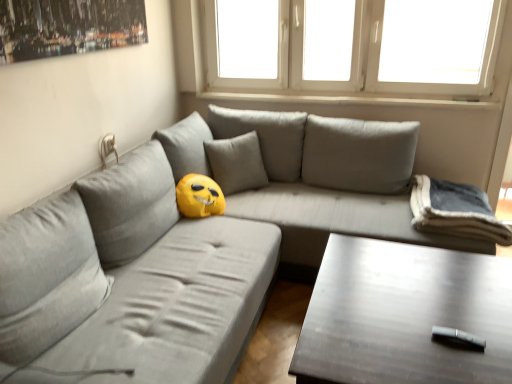
This screenshot has height=384, width=512. Describe the element at coordinates (236, 163) in the screenshot. I see `yellow plush at center, which is the first pillow in left-to-right order` at that location.

Describe the element at coordinates (195, 245) in the screenshot. This screenshot has width=512, height=384. I see `gray fabric couch at center` at that location.

In order to face gray fleece blanket at right, the 1th pillow in the right-to-left sequence, should I rotate leftwards or rightwards?

To align with it, rotate right about 25.381°.

Where is `gray fleece blanket at right, the 1th pillow in the right-to-left sequence`? This screenshot has width=512, height=384. gray fleece blanket at right, the 1th pillow in the right-to-left sequence is located at coordinates (455, 211).

Where is `yellow plush at center, which is the first pillow in left-to-right order`? yellow plush at center, which is the first pillow in left-to-right order is located at coordinates (236, 163).

Looking at this image, from the image's perspective, is dark wood table at lower right above or below gray fabric couch at center?

Clearly, from the image's perspective, dark wood table at lower right is below gray fabric couch at center.

Does dark wood table at lower right have a greater height compared to gray fabric couch at center?

In fact, dark wood table at lower right may be shorter than gray fabric couch at center.

Can you tell me how much dark wood table at lower right and gray fabric couch at center differ in facing direction?

0.325 degrees separate the facing orientations of dark wood table at lower right and gray fabric couch at center.

Is dark wood table at lower right next to gray fabric couch at center?

dark wood table at lower right is not next to gray fabric couch at center, and they're not touching.

Does gray fleece blanket at right, the 1th pillow in the right-to-left sequence, lie behind yellow plush at center, positioned as the second pillow in right-to-left order?

No.

The height and width of the screenshot is (384, 512). What are the coordinates of `pillow behind the gray fleece blanket at right, positioned as the 2th pillow in left-to-right order` in the screenshot? It's located at (236, 163).

Does gray fleece blanket at right, positioned as the 2th pillow in left-to-right order, appear on the right side of yellow plush at center, positioned as the second pillow in right-to-left order?

Yes, gray fleece blanket at right, positioned as the 2th pillow in left-to-right order, is to the right of yellow plush at center, positioned as the second pillow in right-to-left order.

From a real-world perspective, between gray fleece blanket at right, the 1th pillow in the right-to-left sequence, and yellow plush at center, which is the first pillow in left-to-right order, who is vertically higher?

yellow plush at center, which is the first pillow in left-to-right order, is physically above.

Between dark wood table at lower right and gray fleece blanket at right, positioned as the 2th pillow in left-to-right order, which one appears on the left side from the viewer's perspective?

From the viewer's perspective, dark wood table at lower right appears more on the left side.

Is dark wood table at lower right thinner than gray fleece blanket at right, the 1th pillow in the right-to-left sequence?

In fact, dark wood table at lower right might be wider than gray fleece blanket at right, the 1th pillow in the right-to-left sequence.

Is dark wood table at lower right bigger or smaller than gray fleece blanket at right, the 1th pillow in the right-to-left sequence?

dark wood table at lower right is bigger than gray fleece blanket at right, the 1th pillow in the right-to-left sequence.

Locate an element on the screen. pillow that is the 1st one when counting backward from the dark wood table at lower right is located at coordinates (455, 211).

Which of these two, dark wood table at lower right or yellow plush at center, positioned as the second pillow in right-to-left order, is smaller?

yellow plush at center, positioned as the second pillow in right-to-left order.

From their relative heights in the image, would you say dark wood table at lower right is taller or shorter than yellow plush at center, positioned as the second pillow in right-to-left order?

Clearly, dark wood table at lower right is shorter compared to yellow plush at center, positioned as the second pillow in right-to-left order.

Is dark wood table at lower right at the right side of yellow plush at center, positioned as the second pillow in right-to-left order?

Correct, you'll find dark wood table at lower right to the right of yellow plush at center, positioned as the second pillow in right-to-left order.

Is yellow plush at center, which is the first pillow in left-to-right order, turned away from gray fleece blanket at right, positioned as the 2th pillow in left-to-right order?

No, yellow plush at center, which is the first pillow in left-to-right order,'s orientation is not away from gray fleece blanket at right, positioned as the 2th pillow in left-to-right order.

Considering the positions of points (262, 182) and (438, 192), is point (262, 182) farther from camera compared to point (438, 192)?

Yes, it is.

Between yellow plush at center, which is the first pillow in left-to-right order, and gray fleece blanket at right, the 1th pillow in the right-to-left sequence, which one has larger width?

gray fleece blanket at right, the 1th pillow in the right-to-left sequence, is wider.

Between yellow plush at center, positioned as the second pillow in right-to-left order, and gray fleece blanket at right, positioned as the 2th pillow in left-to-right order, which one appears on the left side from the viewer's perspective?

From the viewer's perspective, yellow plush at center, positioned as the second pillow in right-to-left order, appears more on the left side.

How far apart are gray fabric couch at center and white plastic window at upper center?

gray fabric couch at center is 1.28 meters away from white plastic window at upper center.

The image size is (512, 384). I want to click on studio couch on the left of the white plastic window at upper center, so (x=195, y=245).

Can you confirm if gray fabric couch at center is shorter than white plastic window at upper center?

No, gray fabric couch at center is not shorter than white plastic window at upper center.

Looking at this image, does gray fabric couch at center turn towards white plastic window at upper center?

No, gray fabric couch at center does not turn towards white plastic window at upper center.

Which is behind, gray fabric couch at center or dark wood table at lower right?

dark wood table at lower right is further from the camera.

Does point (179, 255) come in front of point (476, 263)?

No, it is behind (476, 263).

From the image's perspective, is gray fabric couch at center under dark wood table at lower right?

Actually, gray fabric couch at center appears above dark wood table at lower right in the image.

What are the coordinates of `table on the right side of gray fabric couch at center` in the screenshot? It's located at (404, 315).

In the image, there is a yellow plush at center, which is the first pillow in left-to-right order. What are the coordinates of `pillow below it (from a real-world perspective)` in the screenshot? It's located at (455, 211).

Estimate the real-world distances between objects in this image. Which object is further from dark wood table at lower right, gray fleece blanket at right, the 1th pillow in the right-to-left sequence, or white plastic window at upper center?

white plastic window at upper center.

Which object lies further to the anchor point gray fabric couch at center, dark wood table at lower right or white plastic window at upper center?

Based on the image, white plastic window at upper center appears to be further to gray fabric couch at center.

From the image, which object appears to be nearer to dark wood table at lower right, yellow plush at center, positioned as the second pillow in right-to-left order, or gray fabric couch at center?

gray fabric couch at center is closer to dark wood table at lower right.

From the picture: Which object lies nearer to the anchor point gray fabric couch at center, dark wood table at lower right or gray fleece blanket at right, the 1th pillow in the right-to-left sequence?

dark wood table at lower right lies closer to gray fabric couch at center than the other object.

Looking at the image, which one is located closer to gray fabric couch at center, dark wood table at lower right or yellow plush at center, which is the first pillow in left-to-right order?

Among the two, yellow plush at center, which is the first pillow in left-to-right order, is located nearer to gray fabric couch at center.

When comparing their distances from gray fleece blanket at right, the 1th pillow in the right-to-left sequence, does yellow plush at center, positioned as the second pillow in right-to-left order, or white plastic window at upper center seem further?

Based on the image, white plastic window at upper center appears to be further to gray fleece blanket at right, the 1th pillow in the right-to-left sequence.

Estimate the real-world distances between objects in this image. Which object is further from gray fabric couch at center, gray fleece blanket at right, the 1th pillow in the right-to-left sequence, or yellow plush at center, which is the first pillow in left-to-right order?

The object further to gray fabric couch at center is gray fleece blanket at right, the 1th pillow in the right-to-left sequence.

Looking at the image, which one is located further to dark wood table at lower right, gray fabric couch at center or white plastic window at upper center?

white plastic window at upper center.

Identify the location of table between gray fabric couch at center and white plastic window at upper center from front to back. (404, 315).

Image resolution: width=512 pixels, height=384 pixels. Identify the location of table located between gray fabric couch at center and yellow plush at center, positioned as the second pillow in right-to-left order, in the depth direction. (404, 315).

Locate an element on the screen. The height and width of the screenshot is (384, 512). window between dark wood table at lower right and yellow plush at center, positioned as the second pillow in right-to-left order, in the front-back direction is located at coordinates (384, 56).

The width and height of the screenshot is (512, 384). Identify the location of table between gray fabric couch at center and gray fleece blanket at right, positioned as the 2th pillow in left-to-right order, from front to back. (404, 315).